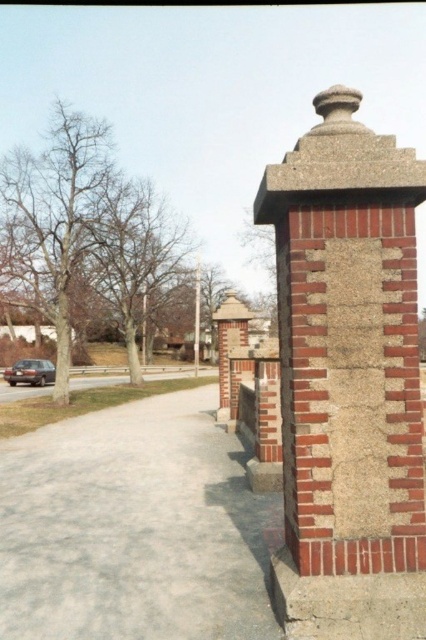
Which of these two, red brick chimney at right or gray concrete pavement at lower left, stands taller?

red brick chimney at right

Does red brick chimney at right appear under gray concrete pavement at lower left?

Actually, red brick chimney at right is above gray concrete pavement at lower left.

Locate an element on the screen. The width and height of the screenshot is (426, 640). red brick chimney at right is located at coordinates (348, 344).